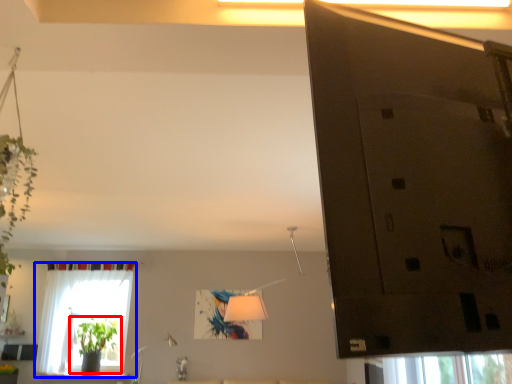
Question: Which object is further to the camera taking this photo, houseplant (highlighted by a red box) or window (highlighted by a blue box)?

Choices:
 (A) houseplant
 (B) window

Answer: (A)